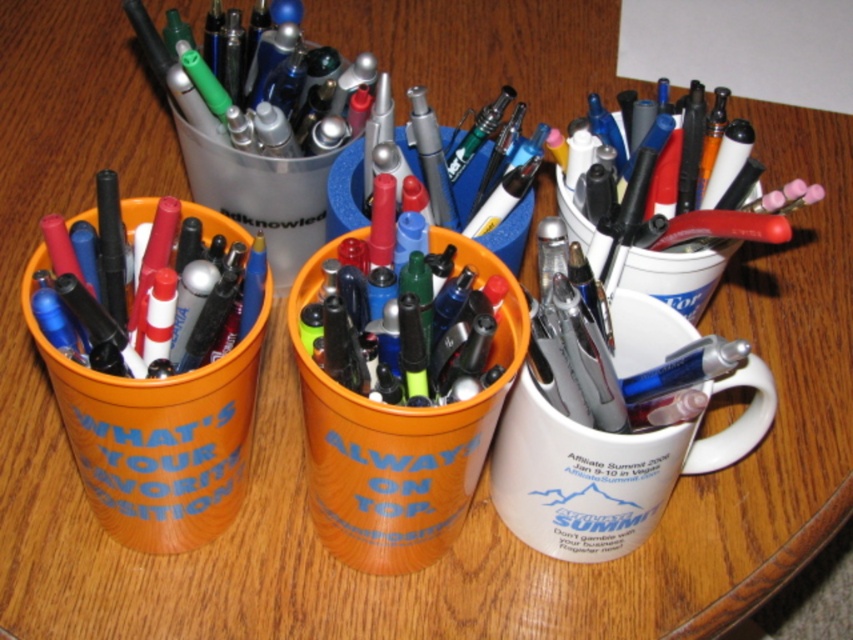
Which is above, matte black pen at left or white glossy mug at upper right?

white glossy mug at upper right is above.

Does matte black pen at left appear over white glossy mug at upper right?

Incorrect, matte black pen at left is not positioned above white glossy mug at upper right.

Locate an element on the screen. This screenshot has width=853, height=640. matte black pen at left is located at coordinates [107, 266].

Who is taller, white ceramic mug at center or metallic silver pen at center?

white ceramic mug at center

Can you confirm if white ceramic mug at center is positioned above metallic silver pen at center?

Actually, white ceramic mug at center is below metallic silver pen at center.

Does point (665, 358) come in front of point (437, 138)?

Yes, it is in front of point (437, 138).

Find the location of `white ceramic mug at center`. white ceramic mug at center is located at coordinates (608, 467).

Based on the photo, can you confirm if white ceramic mug at center is taller than matte black pen at left?

Indeed, white ceramic mug at center has a greater height compared to matte black pen at left.

This screenshot has height=640, width=853. I want to click on white ceramic mug at center, so click(608, 467).